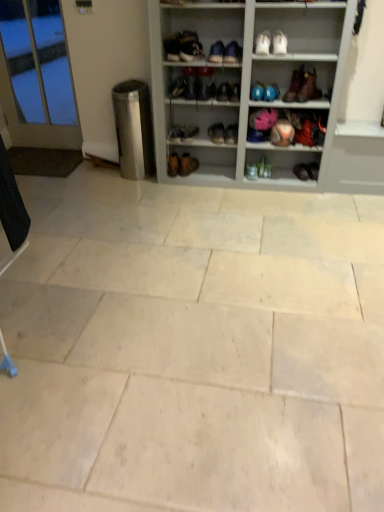
I want to click on vacant space to the right of matte blue shoe at center, the sixth shoe from the left, so coord(290,176).